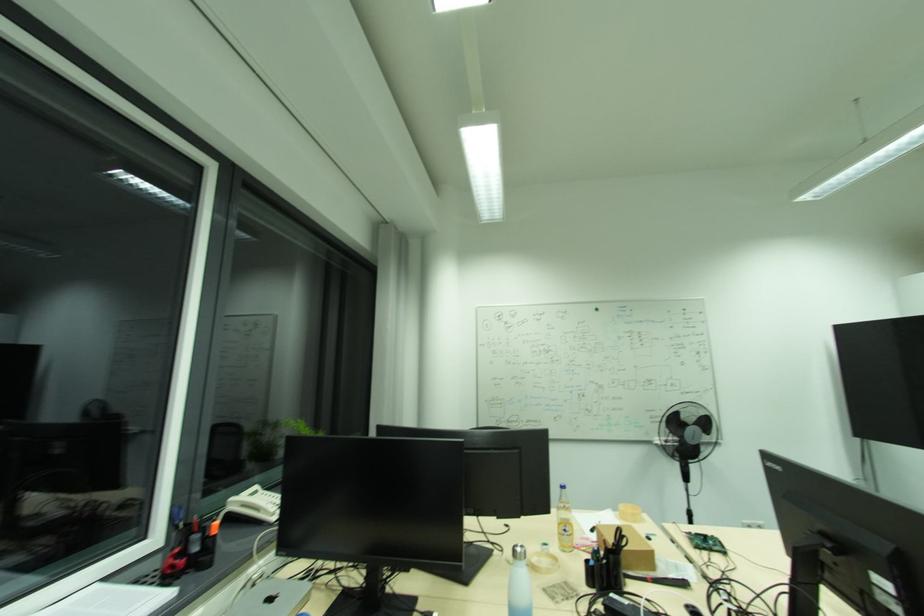
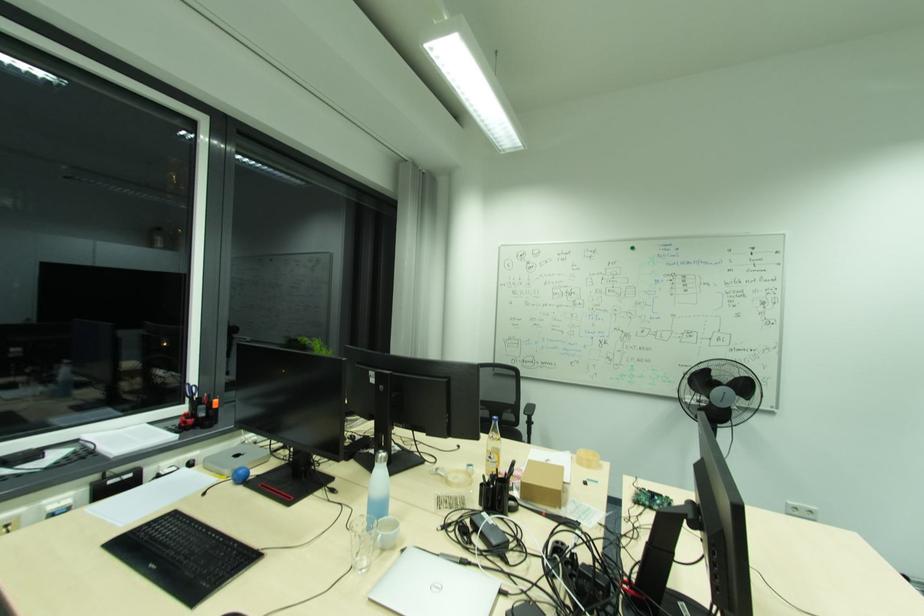
Question: In a continuous first-person perspective shot, in which direction is the camera moving?

Choices:
 (A) Left
 (B) Right
 (C) Forward
 (D) Backward

Answer: (B)